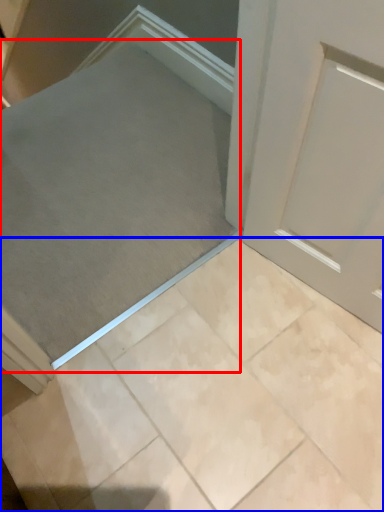
Question: Which object is closer to the camera taking this photo, ramp (highlighted by a red box) or ceramic tile (highlighted by a blue box)?

Choices:
 (A) ramp
 (B) ceramic tile

Answer: (B)